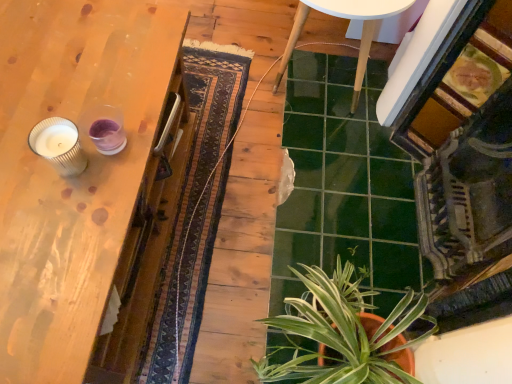
Question: Considering the relative sizes of green glossy plant at lower right and wooden table at left in the image provided, is green glossy plant at lower right smaller than wooden table at left?

Choices:
 (A) no
 (B) yes

Answer: (B)

Question: Is the position of green glossy plant at lower right more distant than that of wooden table at left?

Choices:
 (A) yes
 (B) no

Answer: (A)

Question: Is green glossy plant at lower right bigger than wooden table at left?

Choices:
 (A) yes
 (B) no

Answer: (B)

Question: Would you say green glossy plant at lower right is outside wooden table at left?

Choices:
 (A) no
 (B) yes

Answer: (B)

Question: Is green glossy plant at lower right closer to the viewer compared to wooden table at left?

Choices:
 (A) no
 (B) yes

Answer: (A)

Question: From the image's perspective, relative to green glossy plant at lower right, is white glossy table at center above or below?

Choices:
 (A) below
 (B) above

Answer: (B)

Question: Considering the positions of point (404, 3) and point (382, 382), is point (404, 3) closer or farther from the camera than point (382, 382)?

Choices:
 (A) farther
 (B) closer

Answer: (A)

Question: From a real-world perspective, relative to green glossy plant at lower right, is white glossy table at center vertically above or below?

Choices:
 (A) above
 (B) below

Answer: (A)

Question: Considering their positions, is white glossy table at center located in front of or behind green glossy plant at lower right?

Choices:
 (A) behind
 (B) front

Answer: (A)

Question: Visually, is ridged glass candle at left positioned to the left or to the right of wooden table at left?

Choices:
 (A) right
 (B) left

Answer: (A)

Question: Looking at their shapes, would you say ridged glass candle at left is wider or thinner than wooden table at left?

Choices:
 (A) wide
 (B) thin

Answer: (B)

Question: Is ridged glass candle at left bigger or smaller than wooden table at left?

Choices:
 (A) big
 (B) small

Answer: (B)

Question: From the image's perspective, is ridged glass candle at left above or below wooden table at left?

Choices:
 (A) below
 (B) above

Answer: (B)

Question: In the image, is wooden table at left positioned in front of or behind ridged glass candle at left?

Choices:
 (A) front
 (B) behind

Answer: (A)

Question: Is wooden table at left wider or thinner than ridged glass candle at left?

Choices:
 (A) thin
 (B) wide

Answer: (B)